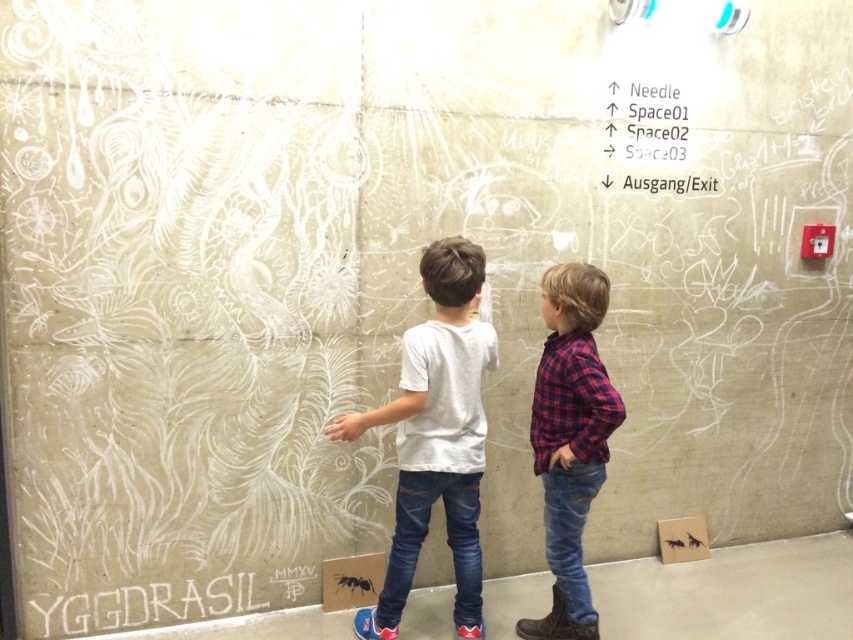
You are a photographer trying to capture a clear shot of the white chalk writing at lower left without any obstruction. Given the presence of the white matte shirt at center, is there a risk that the shirt might block the view of the writing? Please explain.

The white matte shirt at center is located above the white chalk writing at lower left, so it could potentially block the view of the writing depending on the angle and distance. To avoid obstruction, position the camera lower or move closer to ensure the shirt doesn

You are a tailor who needs to measure the plaid fabric shirt at center and the white chalk writing at upper center. Which item has a smaller width?

The plaid fabric shirt at center is thinner than the white chalk writing at upper center, so the plaid fabric shirt at center has a smaller width.